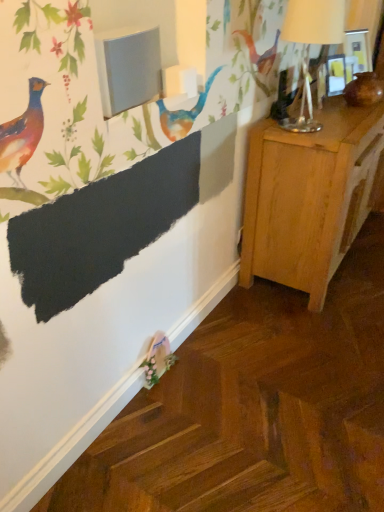
This screenshot has height=512, width=384. What are the coordinates of `vacant region to the right of metallic silver table lamp at upper right` in the screenshot? It's located at (339, 125).